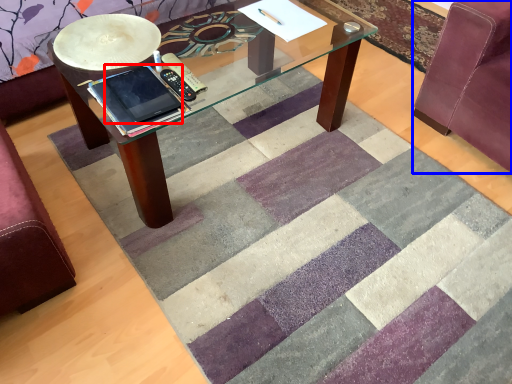
Question: Which of the following is the farthest to the observer, ipad (highlighted by a red box) or swivel chair (highlighted by a blue box)?

Choices:
 (A) ipad
 (B) swivel chair

Answer: (B)